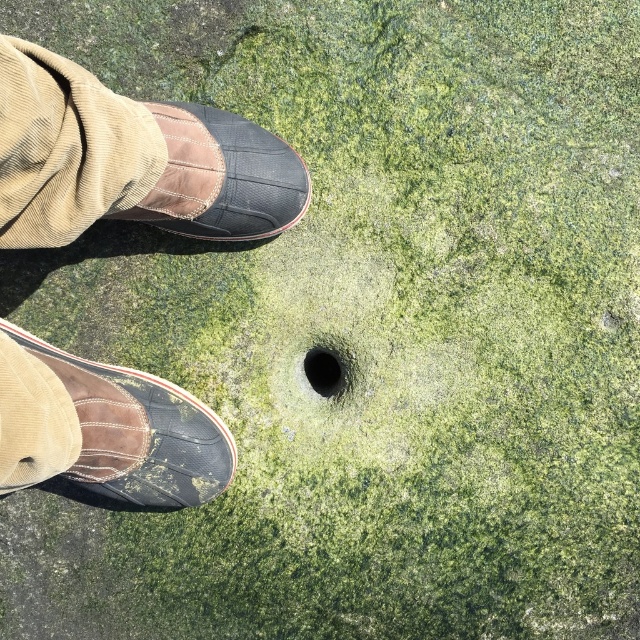
Question: Which point is closer to the camera?

Choices:
 (A) brown leather boot at lower left
 (B) brown suede shoe at lower left
 (C) corduroy pants at upper left

Answer: (C)

Question: Among these objects, which one is nearest to the camera?

Choices:
 (A) black mesh shoe at upper left
 (B) black rubber hole at center
 (C) brown leather boot at lower left

Answer: (C)

Question: Among these points, which one is farthest from the camera?

Choices:
 (A) (22, 172)
 (B) (40, 202)

Answer: (B)

Question: Considering the relative positions of brown leather boot at lower left and brown suede shoe at lower left in the image provided, where is brown leather boot at lower left located with respect to brown suede shoe at lower left?

Choices:
 (A) below
 (B) above

Answer: (B)

Question: Does corduroy pants at upper left have a smaller size compared to black rubber hole at center?

Choices:
 (A) no
 (B) yes

Answer: (A)

Question: Is brown suede shoe at lower left positioned at the back of black rubber hole at center?

Choices:
 (A) no
 (B) yes

Answer: (A)